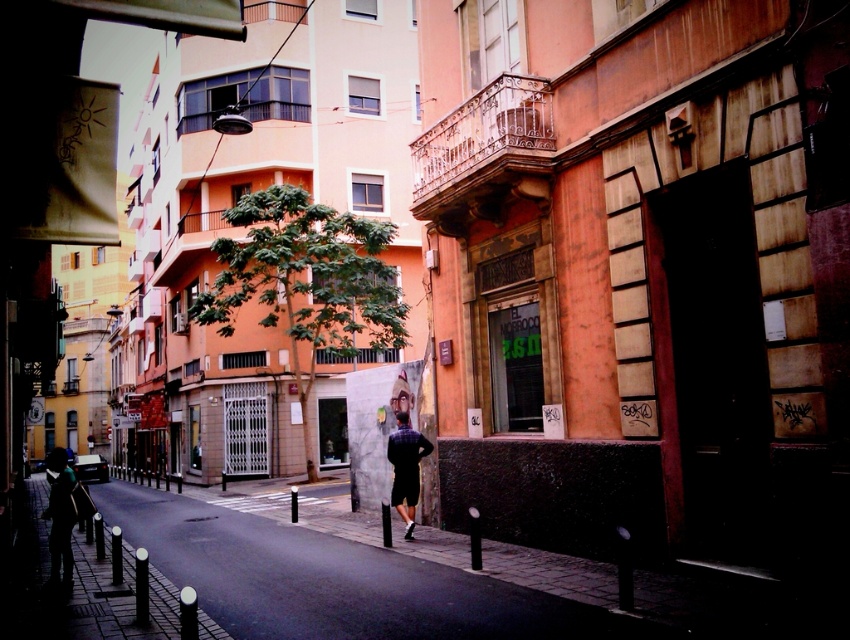
You are standing on the sidewalk in the urban scene and want to walk towards the person walking away. Which of the two points, point [289,528] or point [46,472], should you aim for to get closer to the person?

Point [289,528] is closer to the viewer than point [46,472], so aiming for point [289,528] would bring you closer to the person walking away.

You are standing at the edge of the image and want to walk to the paved stone sidewalk at center. According to the coordinates provided, in which direction should you move to reach it?

A: The paved stone sidewalk at center is located at coordinates point (x=338, y=580). Since you are at the edge, moving towards the center of the image would lead you to the sidewalk.

You are standing on the sidewalk and want to take a photo of both point (75, 520) and point (394, 496) in the scene. Which point should you focus on first to ensure both are in clear view?

You should focus on point (75, 520) first because it is closer to the camera than point (394, 496), ensuring both are in focus when using depth of field.